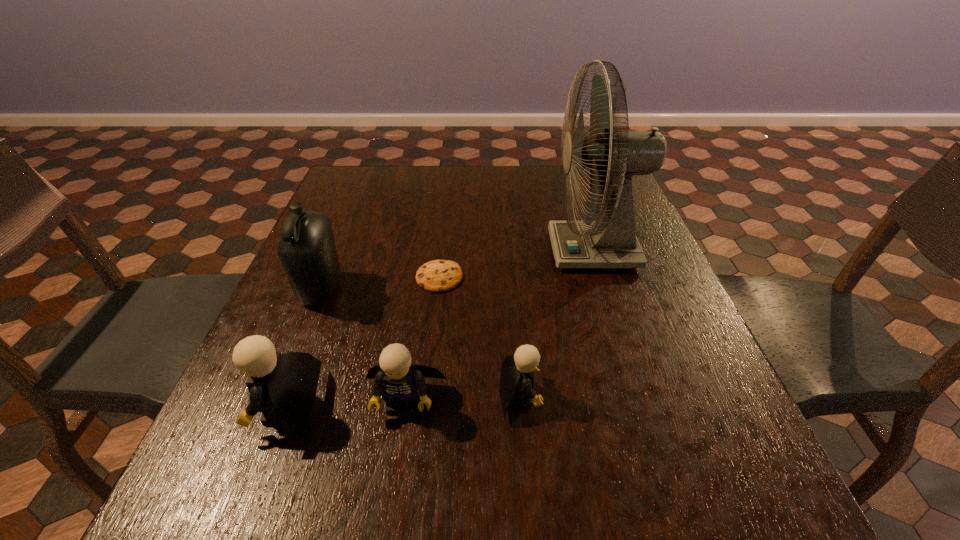
This screenshot has height=540, width=960. Identify the location of free space that satisfies the following two spatial constraints: 1. on the front-facing side of the third shortest object; 2. on the front-facing side of the leftmost Lego. (404, 408).

Identify the location of free space that satisfies the following two spatial constraints: 1. on the front-facing side of the shortest Lego; 2. on the front-facing side of the second Lego from right to left. (520, 401).